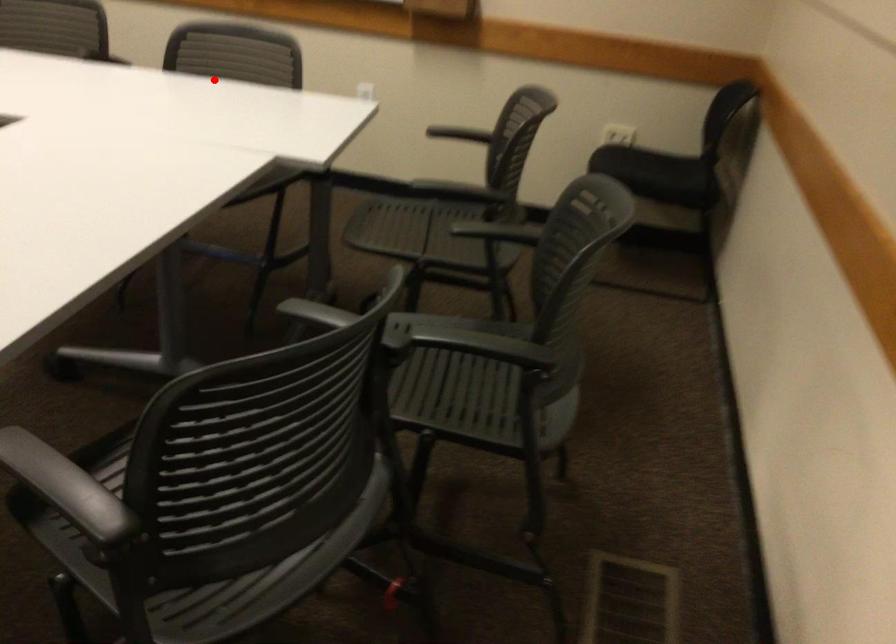
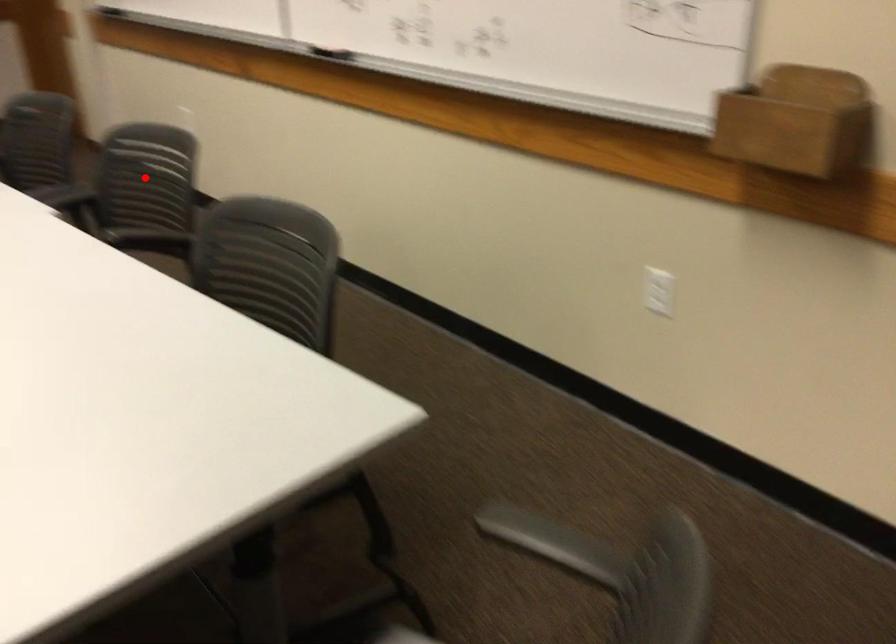
I am providing you with two images of the same scene from different viewpoints. A red point is marked on the first image and another point is marked on the second image. Is the red point in image1 aligned with the point shown in image2?

No